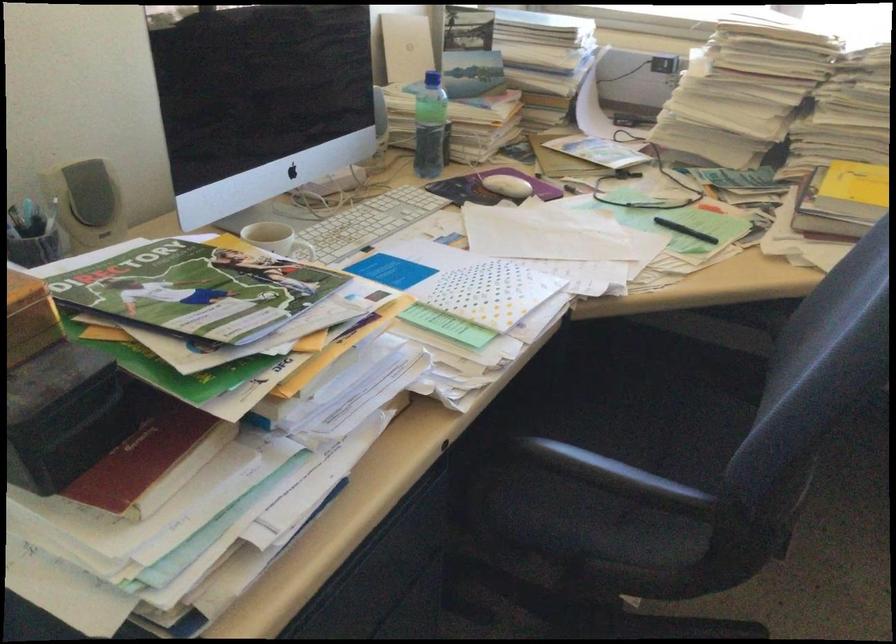
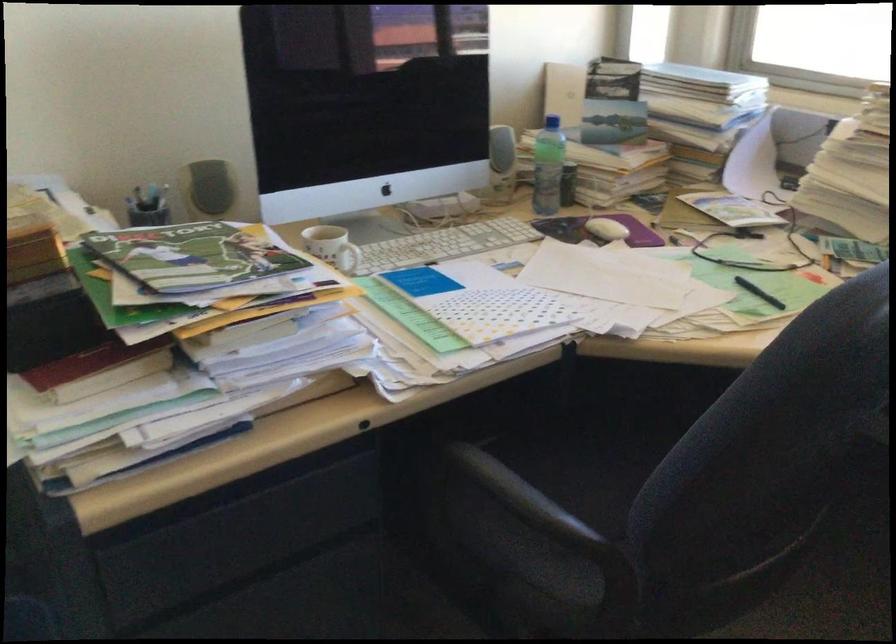
Find the pixel in the second image that matches (x=613, y=431) in the first image.

(616, 478)